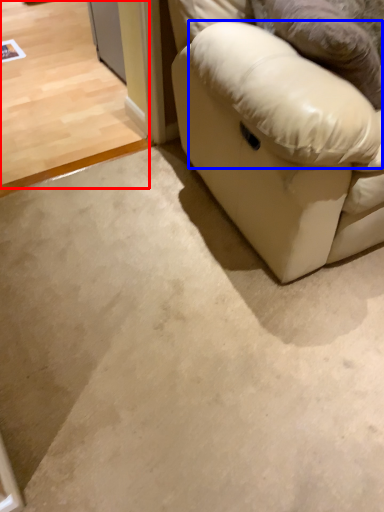
Question: Which object is further to the camera taking this photo, concrete (highlighted by a red box) or pillow (highlighted by a blue box)?

Choices:
 (A) concrete
 (B) pillow

Answer: (A)